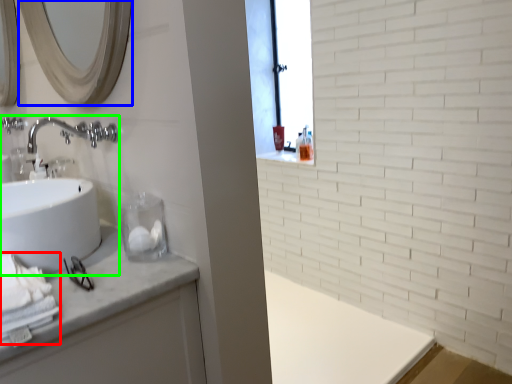
Question: Which object is the closest to the bath towel (highlighted by a red box)? Choose among these: mirror (highlighted by a blue box) or sink (highlighted by a green box).

Choices:
 (A) mirror
 (B) sink

Answer: (B)